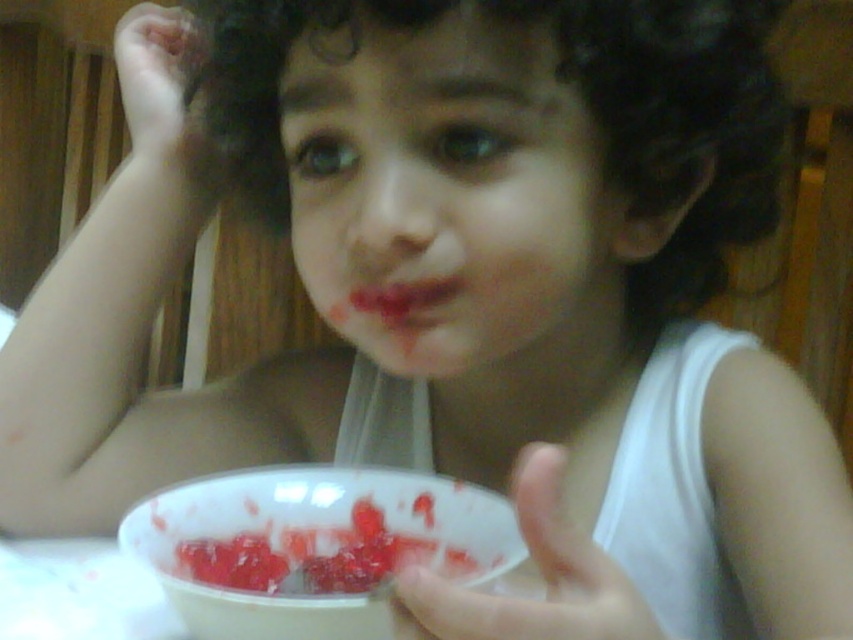
Who is positioned more to the right, white plastic bowl at lower center or slightly glossy plastic bowl at lower center?

From the viewer's perspective, white plastic bowl at lower center appears more on the right side.

Which of these two, white plastic bowl at lower center or slightly glossy plastic bowl at lower center, stands taller?

With more height is white plastic bowl at lower center.

Locate an element on the screen. white plastic bowl at lower center is located at coordinates (312, 547).

Is point (397, 188) in front of point (345, 547)?

Yes, point (397, 188) is closer to viewer.

Which of these two, smooth skin face at center or white plastic bowl at lower center, stands shorter?

Standing shorter between the two is white plastic bowl at lower center.

You are a GUI agent. You are given a task and a screenshot of the screen. Output one action in this format:
    pyautogui.click(x=<x>, y=<y>)
    Task: Click on the smooth skin face at center
    This screenshot has height=640, width=853.
    Given the screenshot: What is the action you would take?
    pyautogui.click(x=447, y=196)

Is point (426, 262) positioned before point (325, 592)?

Yes, it is.

Who is positioned more to the right, smooth skin face at center or slightly glossy plastic bowl at lower center?

smooth skin face at center

Who is more forward, (543, 339) or (334, 572)?

Point (334, 572)

Where is `smooth skin face at center`? The height and width of the screenshot is (640, 853). smooth skin face at center is located at coordinates [447, 196].